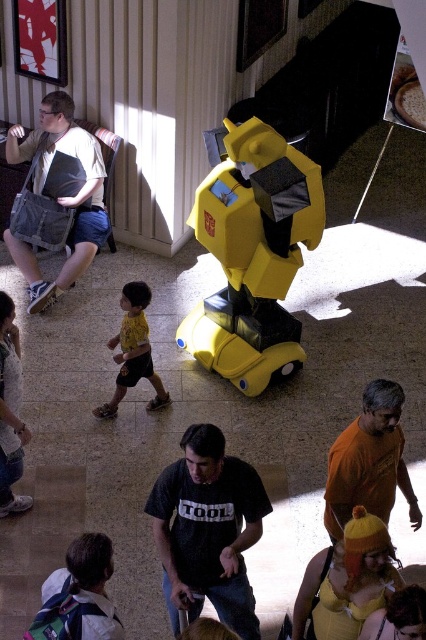
Which is more to the right, yellow matte robot at center or matte gray bag at left?

yellow matte robot at center is more to the right.

Is yellow matte robot at center to the right of matte gray bag at left from the viewer's perspective?

Yes, yellow matte robot at center is to the right of matte gray bag at left.

Between point (279, 161) and point (57, 96), which one is positioned behind?

Positioned behind is point (57, 96).

What are the coordinates of `yellow matte robot at center` in the screenshot? It's located at (253, 256).

Is point (235, 278) closer to viewer compared to point (166, 468)?

No, it is not.

Can you confirm if yellow matte robot at center is wider than black cotton shirt at center?

Correct, the width of yellow matte robot at center exceeds that of black cotton shirt at center.

Is point (230, 144) positioned in front of point (172, 502)?

That is False.

Locate an element on the screen. This screenshot has height=640, width=426. yellow matte robot at center is located at coordinates (253, 256).

How much distance is there between orange matte shirt at lower right and yellow matte shirt at center?

orange matte shirt at lower right and yellow matte shirt at center are 2.32 meters apart from each other.

Is orange matte shirt at lower right shorter than yellow matte shirt at center?

Correct, orange matte shirt at lower right is not as tall as yellow matte shirt at center.

Which is behind, point (357, 499) or point (143, 324)?

The point (143, 324) is behind.

Locate an element on the screen. orange matte shirt at lower right is located at coordinates (370, 461).